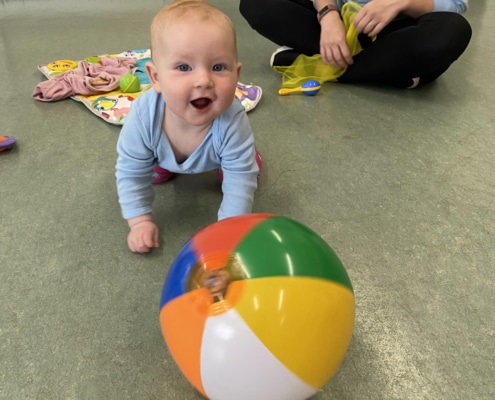
Find the location of a particular element. This screenshot has width=495, height=400. floor is located at coordinates (133, 336).